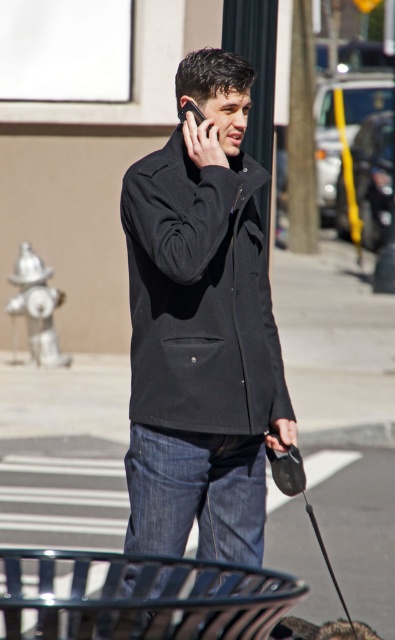
Based on the photo, is black matte jacket at center to the right of silver metallic fire hydrant at lower left from the viewer's perspective?

Yes, black matte jacket at center is to the right of silver metallic fire hydrant at lower left.

Image resolution: width=395 pixels, height=640 pixels. What do you see at coordinates (201, 330) in the screenshot?
I see `black matte jacket at center` at bounding box center [201, 330].

This screenshot has height=640, width=395. Identify the location of black matte jacket at center. (201, 330).

This screenshot has height=640, width=395. I want to click on silver metallic fire hydrant at lower left, so click(37, 307).

Does point (37, 266) come farther from viewer compared to point (197, 120)?

That is True.

I want to click on silver metallic fire hydrant at lower left, so click(37, 307).

From the picture: Is silver metallic fire hydrant at lower left further to camera compared to brown fur dog at lower center?

That is True.

Does silver metallic fire hydrant at lower left appear over brown fur dog at lower center?

Indeed, silver metallic fire hydrant at lower left is positioned over brown fur dog at lower center.

What do you see at coordinates (37, 307) in the screenshot?
I see `silver metallic fire hydrant at lower left` at bounding box center [37, 307].

The width and height of the screenshot is (395, 640). I want to click on silver metallic fire hydrant at lower left, so click(37, 307).